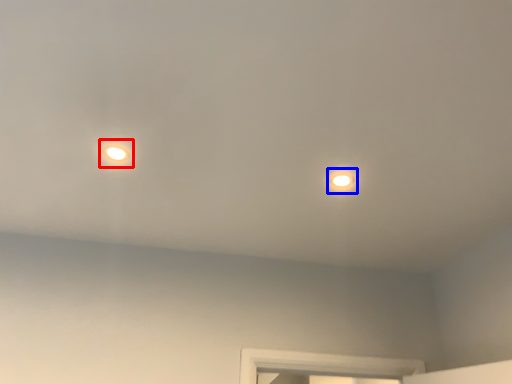
Question: Which object is closer to the camera taking this photo, droplight (highlighted by a red box) or light (highlighted by a blue box)?

Choices:
 (A) droplight
 (B) light

Answer: (A)